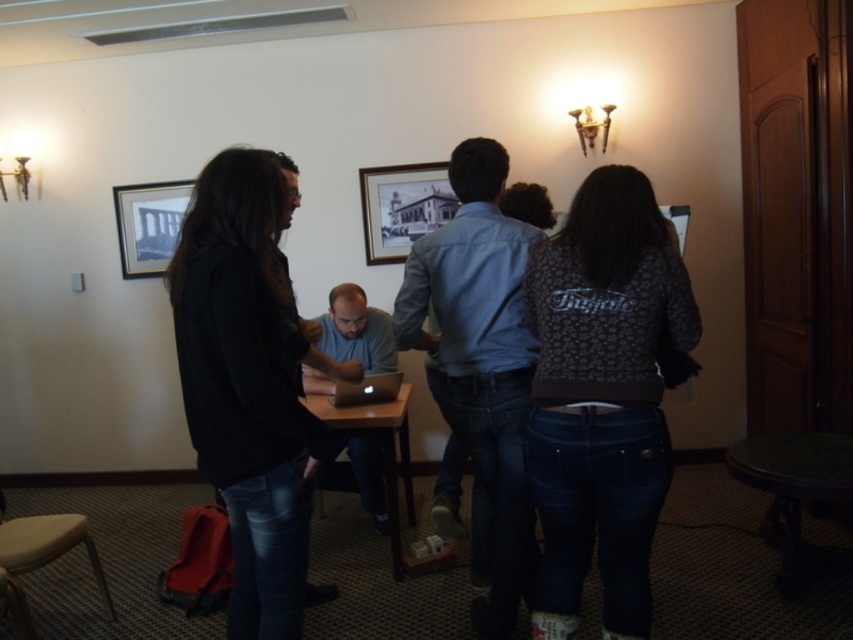
Is green polished wood table at lower right behind gold-framed picture at upper left?

That is False.

Which of these two, green polished wood table at lower right or gold-framed picture at upper left, stands shorter?

gold-framed picture at upper left

Is point (750, 435) positioned before point (171, 225)?

Yes, point (750, 435) is closer to viewer.

The width and height of the screenshot is (853, 640). I want to click on green polished wood table at lower right, so click(796, 496).

Looking at this image, which of these two, wooden framed picture at center or wooden table at center, stands taller?

With more height is wooden table at center.

In the scene shown: Who is shorter, wooden framed picture at center or wooden table at center?

wooden framed picture at center is shorter.

Image resolution: width=853 pixels, height=640 pixels. I want to click on wooden framed picture at center, so click(x=402, y=208).

I want to click on wooden framed picture at center, so click(x=402, y=208).

Does patterned fabric jacket at back right lie in front of black matte jacket at left?

That is False.

Is patterned fabric jacket at back right bigger than black matte jacket at left?

Actually, patterned fabric jacket at back right might be smaller than black matte jacket at left.

Which is behind, point (572, 401) or point (289, 337)?

The point (289, 337) is more distant.

The height and width of the screenshot is (640, 853). What are the coordinates of `patterned fabric jacket at back right` in the screenshot? It's located at (602, 397).